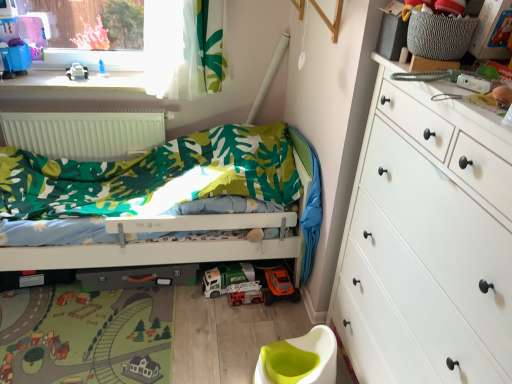
At what (x,y) coordinates should I click in order to perform the action: click on metallic silver fire truck at center, which ranks as the 2th toy car in top-to-bottom order. Please return your answer as a coordinate pair (x, y). The width and height of the screenshot is (512, 384). Looking at the image, I should click on (245, 293).

You are a GUI agent. You are given a task and a screenshot of the screen. Output one action in this format:
    pyautogui.click(x=<x>, y=<y>)
    Task: Click on the white glossy toilet bowl at lower center
    Image resolution: width=512 pixels, height=384 pixels.
    Given the screenshot: What is the action you would take?
    pyautogui.click(x=298, y=359)

In order to face white glossy toilet bowl at lower center, should I rotate leftwards or rightwards?

To face it directly, rotate right by 5.518 degrees.

What are the coordinates of `orange matte toy car at lower center` in the screenshot? It's located at (279, 285).

What do you see at coordinates (279, 285) in the screenshot?
I see `orange matte toy car at lower center` at bounding box center [279, 285].

Find the location of a particular element. Image resolution: width=512 pixels, height=384 pixels. white plastic toy car at upper left is located at coordinates (75, 81).

Is white glossy toilet bowl at lower center inside or outside of white plastic toy car at upper left?

white glossy toilet bowl at lower center is spatially situated outside white plastic toy car at upper left.

In terms of width, does white glossy toilet bowl at lower center look wider or thinner when compared to white plastic toy car at upper left?

white glossy toilet bowl at lower center is wider than white plastic toy car at upper left.

From the image's perspective, which is above, white glossy toilet bowl at lower center or white plastic toy car at upper left?

white plastic toy car at upper left appears higher in the image.

In the scene shown: Between white glossy toilet bowl at lower center and white plastic toy car at upper left, which one has larger size?

white glossy toilet bowl at lower center is bigger.

Is white plastic toy car at upper left positioned with its back to white glossy toilet bowl at lower center?

No, white plastic toy car at upper left is not facing the opposite direction of white glossy toilet bowl at lower center.

The height and width of the screenshot is (384, 512). In order to click on toilet bowl on the right side of white plastic toy car at upper left in this screenshot , I will do `click(298, 359)`.

Can you confirm if white plastic toy car at upper left is shorter than white glossy toilet bowl at lower center?

Correct, white plastic toy car at upper left is not as tall as white glossy toilet bowl at lower center.

In the scene shown: Based on their positions, is white matte chest of drawers at right located to the left or right of white plastic toy car at lower center, marked as the 2th toy car in a bottom-to-top arrangement?

Based on their positions, white matte chest of drawers at right is located to the right of white plastic toy car at lower center, marked as the 2th toy car in a bottom-to-top arrangement.

From a real-world perspective, between white matte chest of drawers at right and white plastic toy car at lower center, which ranks as the first toy car in top-to-bottom order, who is vertically higher?

From a 3D spatial view, white matte chest of drawers at right is above.

From the picture: Is white plastic toy car at lower center, which ranks as the first toy car in top-to-bottom order, a part of white matte chest of drawers at right?

No, white plastic toy car at lower center, which ranks as the first toy car in top-to-bottom order, is not a part of white matte chest of drawers at right.

Where is `the chest of drawers that appears in front of the white plastic toy car at lower center, which ranks as the first toy car in top-to-bottom order`? The width and height of the screenshot is (512, 384). the chest of drawers that appears in front of the white plastic toy car at lower center, which ranks as the first toy car in top-to-bottom order is located at coordinates (426, 240).

Who is shorter, white matte chest of drawers at right or white plastic toy car at upper left?

white plastic toy car at upper left is shorter.

Measure the distance from white matte chest of drawers at right to white plastic toy car at upper left.

white matte chest of drawers at right is 6.17 feet away from white plastic toy car at upper left.

Based on the photo, from a real-world perspective, between white matte chest of drawers at right and white plastic toy car at upper left, who is vertically higher?

white plastic toy car at upper left.

Can you confirm if white matte chest of drawers at right is smaller than white plastic toy car at upper left?

No, white matte chest of drawers at right is not smaller than white plastic toy car at upper left.

From the image's perspective, relative to orange matte toy car at lower center, is white plastic toy car at lower center, which ranks as the first toy car in top-to-bottom order, above or below?

white plastic toy car at lower center, which ranks as the first toy car in top-to-bottom order, is above orange matte toy car at lower center.

Based on the photo, which is in front, white plastic toy car at lower center, which ranks as the first toy car in top-to-bottom order, or orange matte toy car at lower center?

Positioned in front is orange matte toy car at lower center.

From a real-world perspective, is white plastic toy car at lower center, which ranks as the first toy car in top-to-bottom order, above or below orange matte toy car at lower center?

From a real-world perspective, white plastic toy car at lower center, which ranks as the first toy car in top-to-bottom order, is physically below orange matte toy car at lower center.

Which is behind, point (79, 64) or point (280, 275)?

Point (79, 64)

Is white plastic toy car at upper left positioned beyond the bounds of orange matte toy car at lower center?

Yes.

From the image's perspective, is white plastic toy car at upper left positioned above or below orange matte toy car at lower center?

white plastic toy car at upper left is situated higher than orange matte toy car at lower center in the image.

Consider the image. From a real-world perspective, relative to orange matte toy car at lower center, is white plastic toy car at upper left vertically above or below?

white plastic toy car at upper left is above orange matte toy car at lower center.

Is white plastic toy car at upper left facing away from orange matte toy car at lower center?

No, orange matte toy car at lower center is not at the back of white plastic toy car at upper left.

Is white plastic toy car at upper left positioned beyond the bounds of orange matte toy car at lower center?

white plastic toy car at upper left is positioned outside orange matte toy car at lower center.

Can you tell me how much white plastic toy car at upper left and orange matte toy car at lower center differ in facing direction?

0.711 degrees.

Which object is wider, white plastic toy car at upper left or orange matte toy car at lower center?

white plastic toy car at upper left.

The image size is (512, 384). In order to click on window sill that is above the white glossy toilet bowl at lower center (from a real-world perspective) in this screenshot , I will do `click(75, 81)`.

You are a GUI agent. You are given a task and a screenshot of the screen. Output one action in this format:
    pyautogui.click(x=<x>, y=<y>)
    Task: Click on the toilet bowl that appears below the white plastic toy car at upper left (from the image's perspective)
    
    Given the screenshot: What is the action you would take?
    pyautogui.click(x=298, y=359)

Which object lies further to the anchor point white matte chest of drawers at right, white plastic toy car at upper left or white matte radiator at upper left?

white plastic toy car at upper left.

Based on the photo, which object lies nearer to the anchor point white plastic toy car at upper left, metallic silver fire truck at center, which ranks as the 2th toy car in top-to-bottom order, or white glossy toilet bowl at lower center?

metallic silver fire truck at center, which ranks as the 2th toy car in top-to-bottom order, lies closer to white plastic toy car at upper left than the other object.

Which object lies nearer to the anchor point white plastic toy car at upper left, metallic silver fire truck at center, which is the 1th toy car in bottom-to-top order, or matte green fabric bed at center?

matte green fabric bed at center is positioned closer to the anchor white plastic toy car at upper left.

From the image, which object appears to be nearer to white matte chest of drawers at right, white matte radiator at upper left or white glossy toilet bowl at lower center?

white glossy toilet bowl at lower center.

Which object lies nearer to the anchor point matte green fabric bed at center, white matte radiator at upper left or white plastic toy car at upper left?

white matte radiator at upper left is positioned closer to the anchor matte green fabric bed at center.

Considering their positions, is orange matte toy car at lower center positioned closer to metallic silver fire truck at center, which is the 1th toy car in bottom-to-top order, than white plastic toy car at lower center, which ranks as the first toy car in top-to-bottom order?

white plastic toy car at lower center, which ranks as the first toy car in top-to-bottom order, lies closer to metallic silver fire truck at center, which is the 1th toy car in bottom-to-top order, than the other object.

Which object lies further to the anchor point orange matte toy car at lower center, white glossy toilet bowl at lower center or white plastic toy car at upper left?

The object further to orange matte toy car at lower center is white plastic toy car at upper left.

Which object lies further to the anchor point white plastic toy car at upper left, white plastic toy car at lower center, which ranks as the first toy car in top-to-bottom order, or white plastic toy car at upper left?

Among the two, white plastic toy car at lower center, which ranks as the first toy car in top-to-bottom order, is located further to white plastic toy car at upper left.

Locate an element on the screen. toilet bowl between white matte chest of drawers at right and white plastic toy car at lower center, which ranks as the first toy car in top-to-bottom order, along the z-axis is located at coordinates (298, 359).

Locate an element on the screen. Image resolution: width=512 pixels, height=384 pixels. toy between white glossy toilet bowl at lower center and metallic silver fire truck at center, which is the 1th toy car in bottom-to-top order, along the z-axis is located at coordinates (279, 285).

Locate an element on the screen. This screenshot has width=512, height=384. infant bed between white matte radiator at upper left and white plastic toy car at lower center, marked as the 2th toy car in a bottom-to-top arrangement, from left to right is located at coordinates (149, 184).

Locate an element on the screen. toy between white matte radiator at upper left and white glossy toilet bowl at lower center is located at coordinates (279, 285).